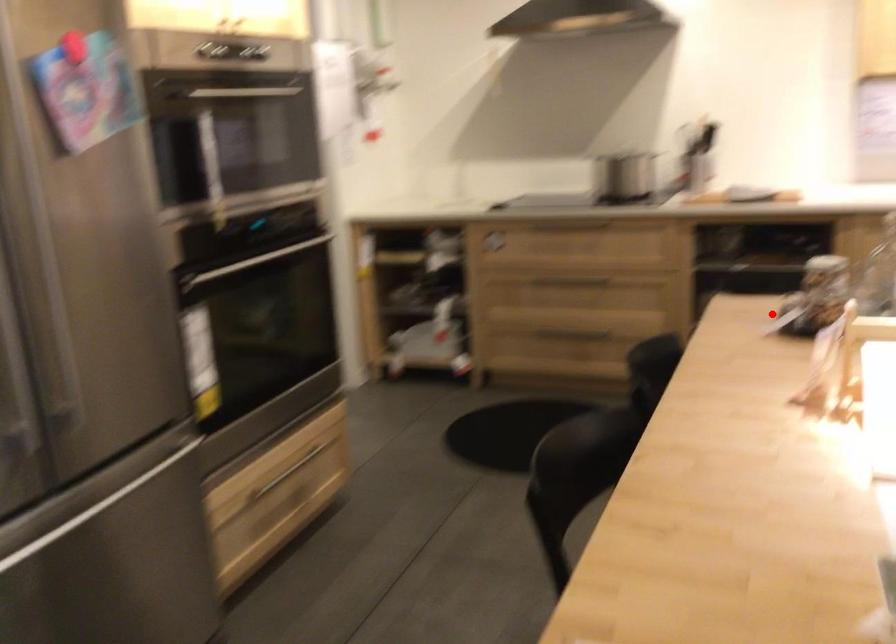
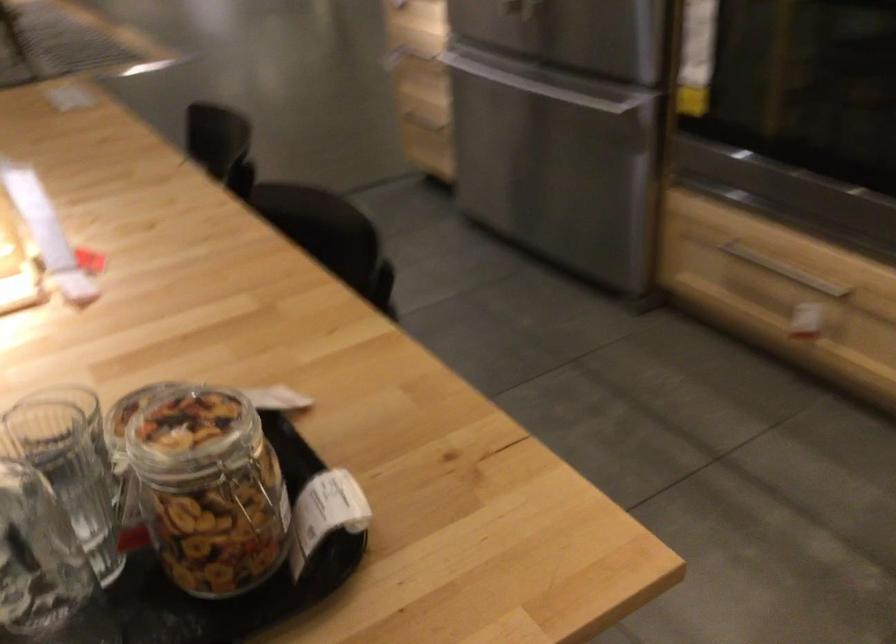
Find the pixel in the second image that matches the highlighted location in the first image.

(293, 453)